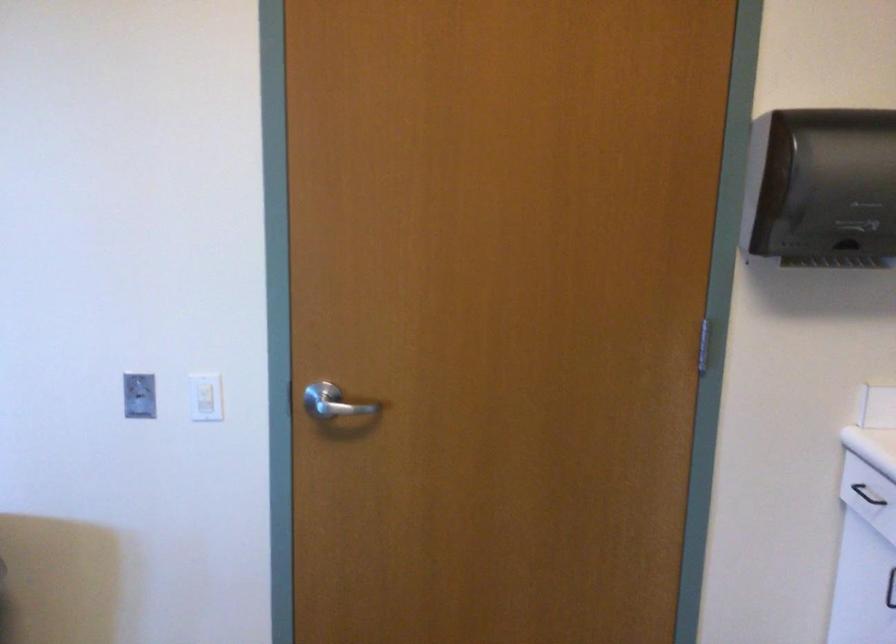
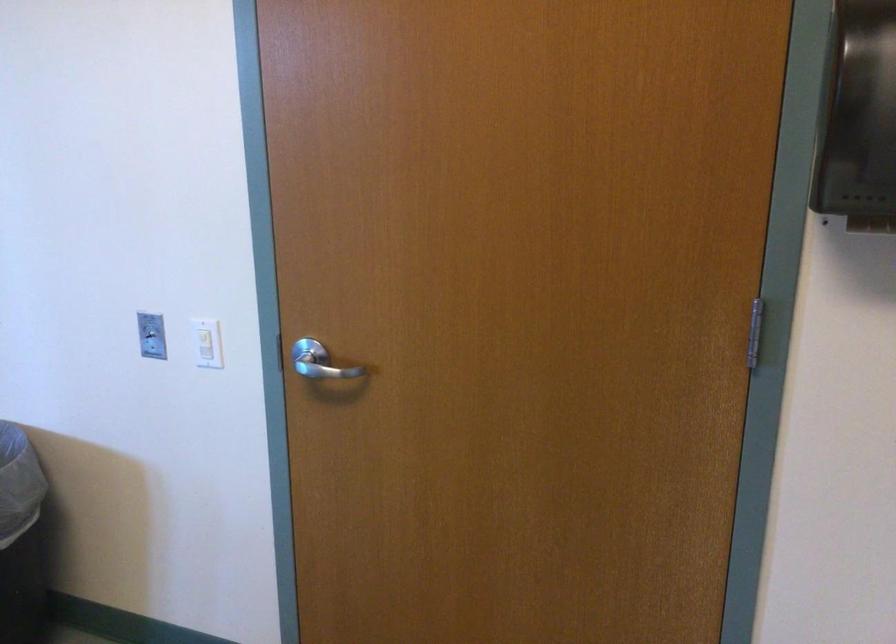
Find the pixel in the second image that matches point 205,401 in the first image.

(205, 346)